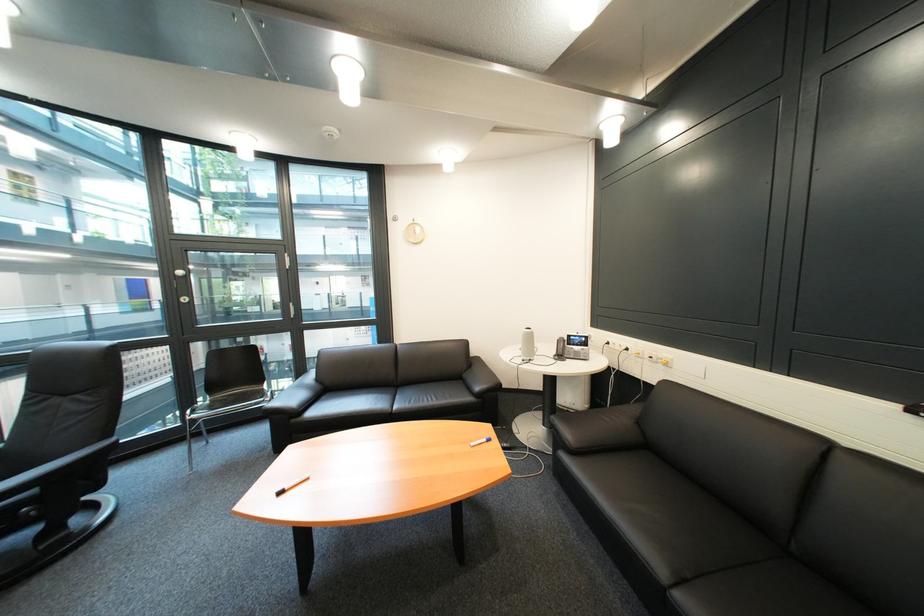
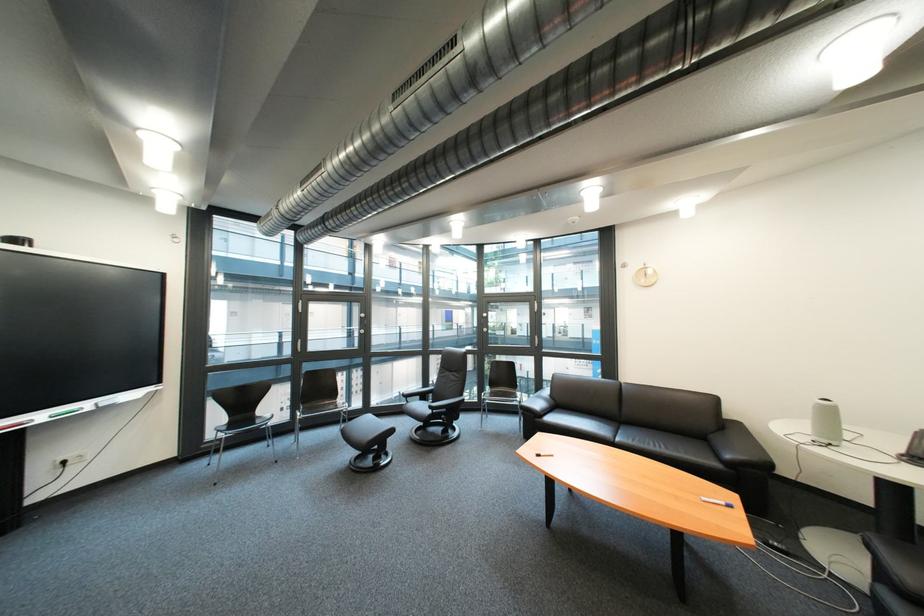
The point at (x=485, y=446) is marked in the first image. Where is the corresponding point in the second image?

(718, 501)